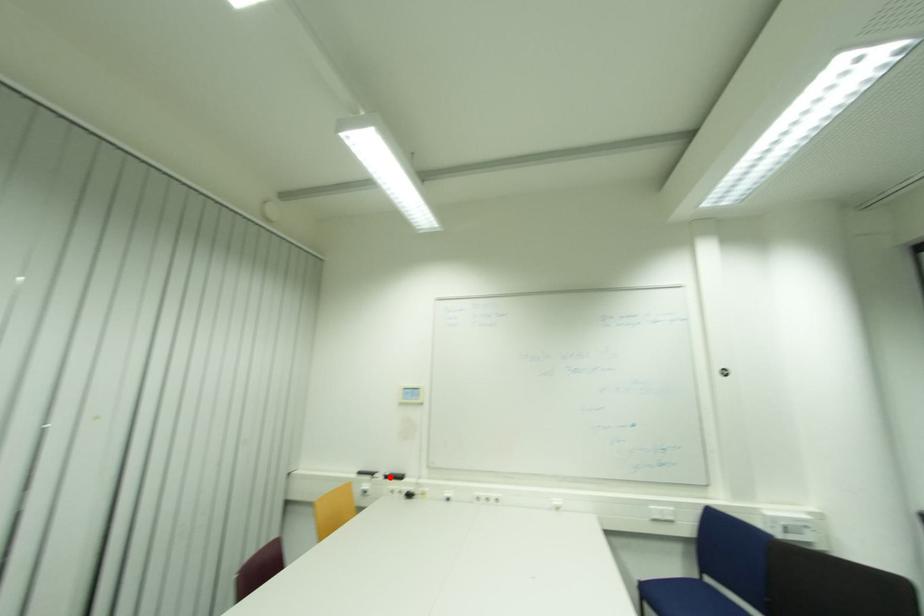
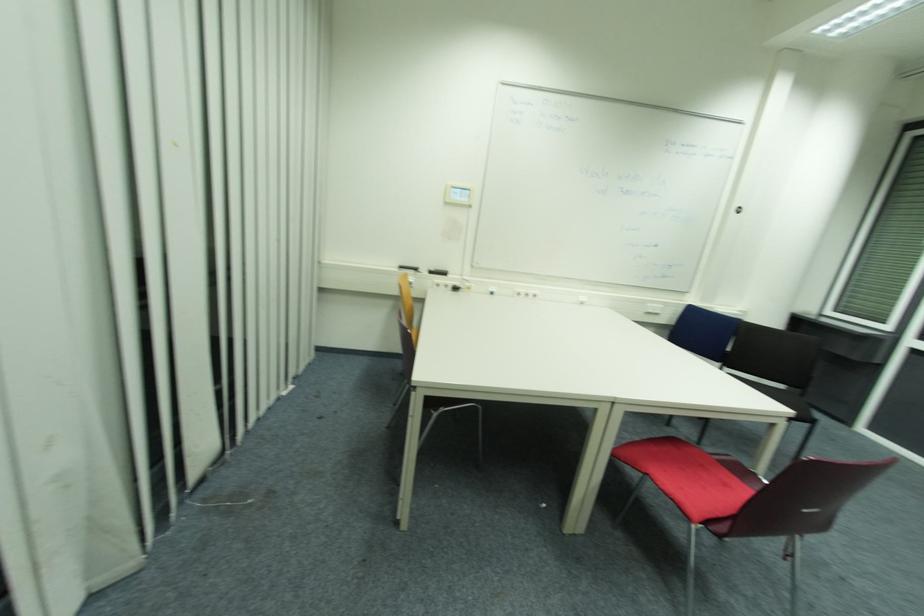
In the second image, find the point that corresponds to the highlighted location in the first image.

(433, 273)